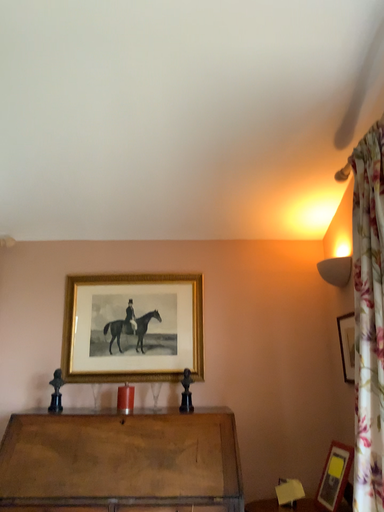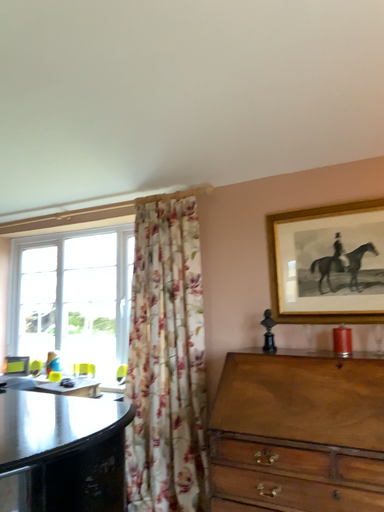
Question: Which way did the camera rotate in the video?

Choices:
 (A) rotated downward
 (B) rotated upward

Answer: (A)